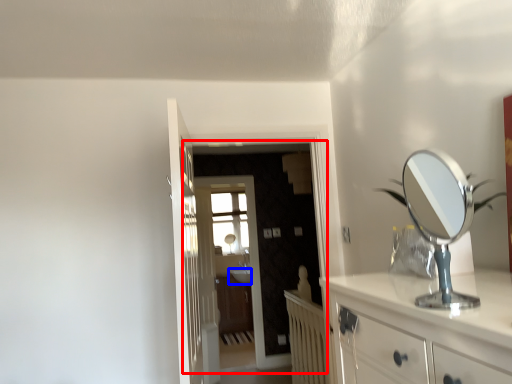
Question: Which point is closer to the camera, screen door (highlighted by a red box) or sink (highlighted by a blue box)?

Choices:
 (A) screen door
 (B) sink

Answer: (A)